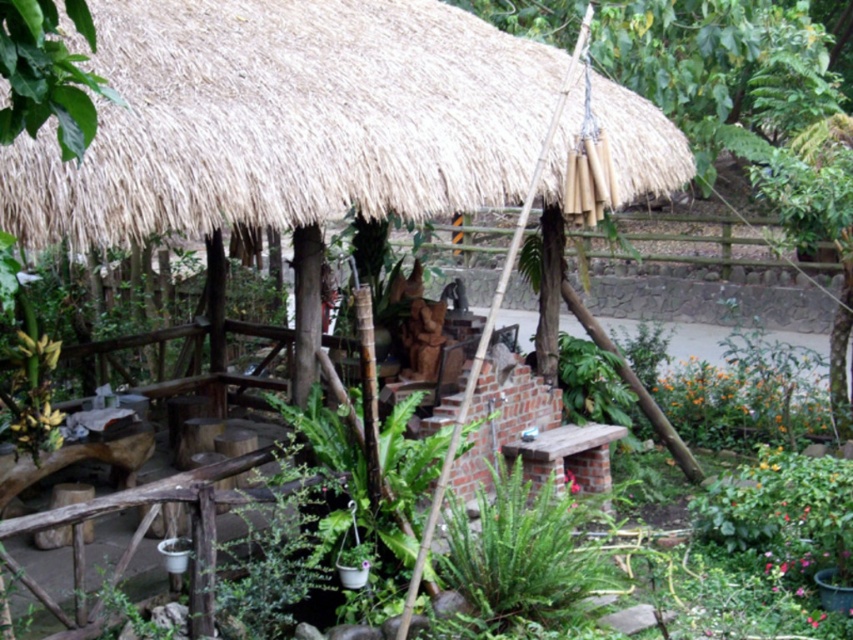
Based on the scene description, where is the natural thatch roof at upper center located in the image?

The natural thatch roof at upper center is located at the 2D coordinates of point (x=287, y=120).

You are planning to install a new light fixture in the garden. The light fixture needs to be placed above the green leafy plant at center. Given that the natural thatch roof at upper center is in the way, can the light fixture be installed without touching the roof?

The natural thatch roof at upper center is larger in size than the green leafy plant at center. Since the roof is larger, it might extend over the area where the plant is located, making it difficult to install the light fixture without touching the roof.

You are standing in the rustic outdoor setting and want to place a small potted plant between the two points, point (368, 145) and point (486, 561). Which point should the plant be closer to if you want it to appear larger in the photo?

The plant should be placed closer to point (368, 145) because it is closer to the camera than point (486, 561), making objects near it appear larger in the photo.